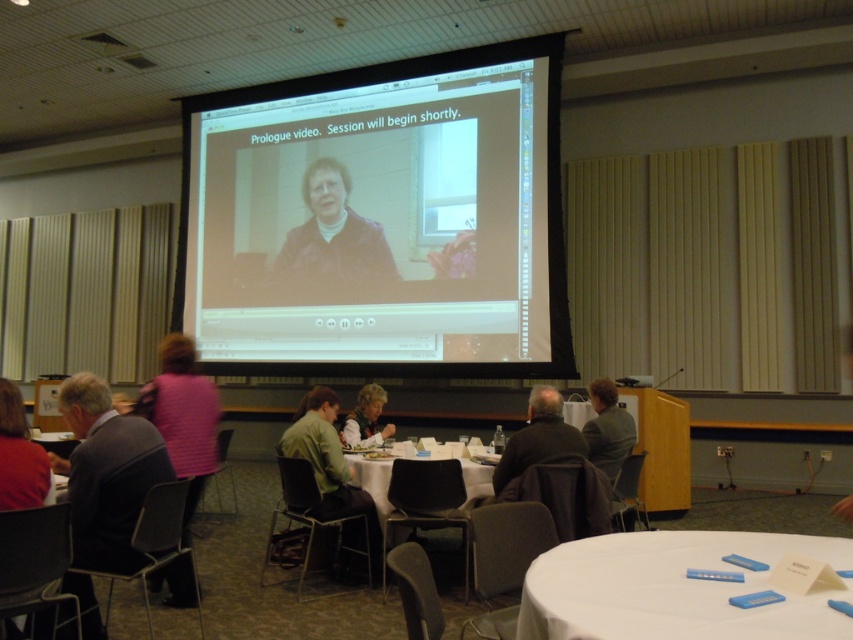
You are organizing a conference and need to arrange jackets on a shelf. The shelf has limited vertical space. Given the gray suit jacket at left and the green fabric jacket at lower center, which jacket should you place first to maximize shelf space efficiency?

The gray suit jacket at left has a lesser height compared to the green fabric jacket at lower center. To maximize shelf space efficiency, place the taller green fabric jacket at lower center first, as it requires more vertical space, followed by the shorter gray suit jacket at left.

You are a conference attendee who just arrived and need to find your seat. You see a gray suit jacket at left and a white plastic table at center. Which object is closer to the entrance of the room?

The gray suit jacket at left is positioned on the left side of white plastic table at center, so it is closer to the entrance than the white plastic table at center.